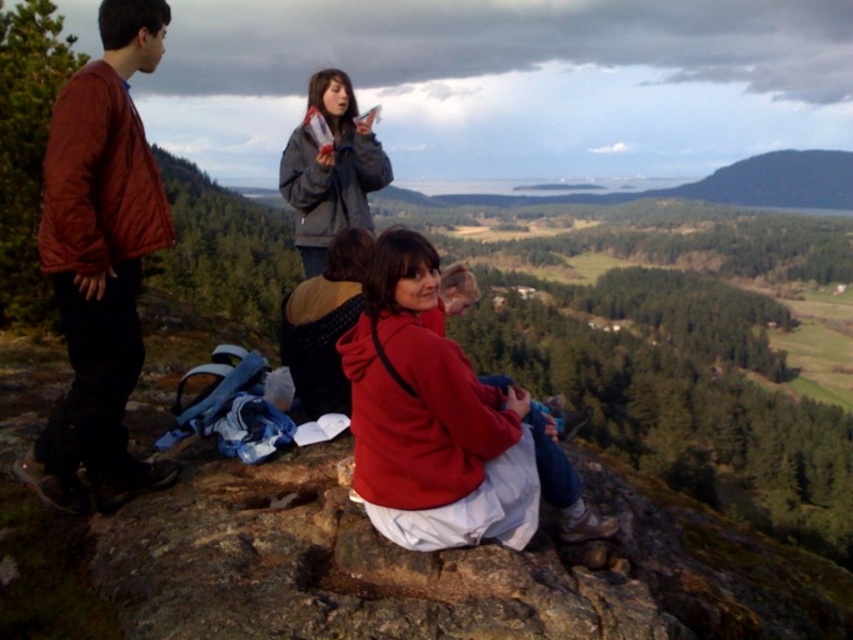
Can you confirm if matte red hoodie at center is positioned to the left of gray leather jacket at upper center?

No, matte red hoodie at center is not to the left of gray leather jacket at upper center.

Does matte red hoodie at center have a greater height compared to gray leather jacket at upper center?

No, matte red hoodie at center is not taller than gray leather jacket at upper center.

Is point (502, 408) positioned after point (352, 156)?

No.

I want to click on matte red hoodie at center, so click(x=440, y=416).

Does matte brown jacket at left have a larger size compared to gray leather jacket at upper center?

No.

Is matte brown jacket at left shorter than gray leather jacket at upper center?

Indeed, matte brown jacket at left has a lesser height compared to gray leather jacket at upper center.

Is point (73, 499) less distant than point (312, 173)?

Yes, it is.

Find the location of `matte brown jacket at left`. matte brown jacket at left is located at coordinates (100, 262).

Is matte brown jacket at left below matte red hoodie at center?

No, matte brown jacket at left is not below matte red hoodie at center.

Does matte brown jacket at left lie behind matte red hoodie at center?

Yes.

Is point (102, 481) less distant than point (461, 468)?

That is False.

You are a GUI agent. You are given a task and a screenshot of the screen. Output one action in this format:
    pyautogui.click(x=<x>, y=<y>)
    Task: Click on the matte brown jacket at left
    The height and width of the screenshot is (640, 853).
    Given the screenshot: What is the action you would take?
    pyautogui.click(x=100, y=262)